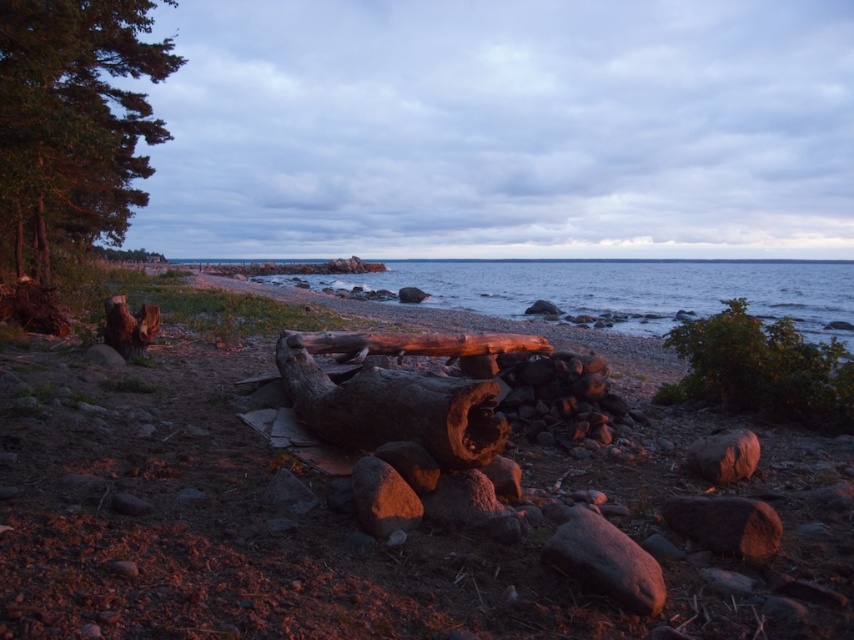
Question: Is green leafy bush at right to the left of green rough tree trunk at upper left from the viewer's perspective?

Choices:
 (A) yes
 (B) no

Answer: (B)

Question: Which object is closer to the camera taking this photo?

Choices:
 (A) green leafy bush at right
 (B) blue water at center
 (C) green rough tree trunk at upper left
 (D) smooth wooden bench at center

Answer: (A)

Question: Can you confirm if smooth brown log at center is smaller than smooth wooden bench at center?

Choices:
 (A) no
 (B) yes

Answer: (B)

Question: Which is farther from the rough wooden log at center?

Choices:
 (A) green leafy tree at upper left
 (B) green leafy bush at right
 (C) green rough tree trunk at upper left
 (D) smooth wooden bench at center

Answer: (D)

Question: Can you confirm if blue water at center is bigger than green rough tree trunk at upper left?

Choices:
 (A) yes
 (B) no

Answer: (A)

Question: Which is nearer to the green rough tree trunk at upper left?

Choices:
 (A) green leafy tree at upper left
 (B) green leafy bush at right
 (C) smooth wooden bench at center

Answer: (A)